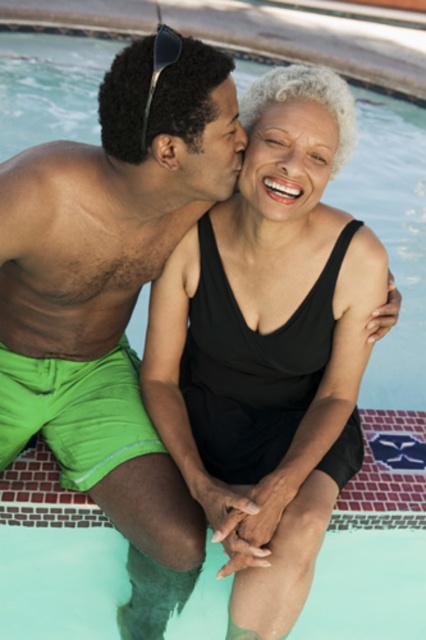
Question: Which point is closer to the camera?

Choices:
 (A) green matte shorts at left
 (B) black matte swimsuit at center
 (C) matte black sunglasses at upper left

Answer: (C)

Question: Can you confirm if black matte swimsuit at center is bigger than matte black sunglasses at upper left?

Choices:
 (A) yes
 (B) no

Answer: (A)

Question: Is green matte shorts at left below matte black sunglasses at upper left?

Choices:
 (A) no
 (B) yes

Answer: (B)

Question: Which of these objects is positioned farthest from the matte black sunglasses at upper left?

Choices:
 (A) black matte swimsuit at center
 (B) green matte shorts at left

Answer: (A)

Question: Is green matte shorts at left positioned in front of matte black sunglasses at upper left?

Choices:
 (A) no
 (B) yes

Answer: (A)

Question: Which is farther from the green matte shorts at left?

Choices:
 (A) black matte swimsuit at center
 (B) matte black sunglasses at upper left

Answer: (B)